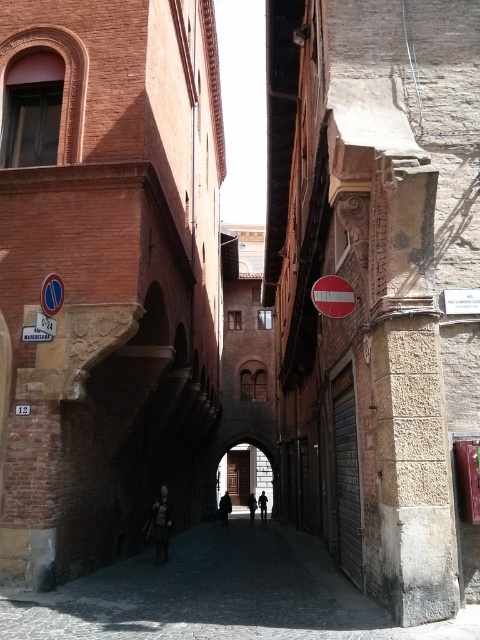
Looking at this image, you are a delivery person with a 1.2 meter wide cart. You see the red plastic stop sign at center and the black leather jacket at center in the narrow cobblestone street. Can your cart pass through the space between them?

The red plastic stop sign at center might be wider than the black leather jacket at center, so there is uncertainty about whether the 1.2 meter wide cart can pass through the space between them. Check the actual width before proceeding.

In the scene shown: You are standing in the narrow cobblestone street and want to take a photo of the blue plastic sign at upper left without the dark gray fabric jacket at center blocking the view. Is it possible to do so while staying in your current position?

The dark gray fabric jacket at center is further to the viewer than the blue plastic sign at upper left, so the jacket is closer to you and would block the view of the sign. To take a photo of the blue plastic sign at upper left without obstruction, you would need to move closer to the sign or reposition yourself so the jacket is no longer in front of it.